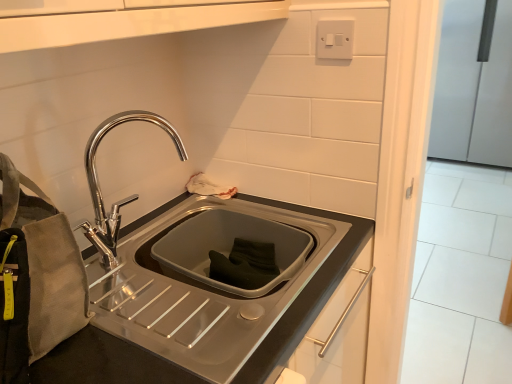
Describe the element at coordinates (335, 39) in the screenshot. I see `white plastic switch at upper right` at that location.

This screenshot has width=512, height=384. I want to click on polished metal faucet at upper left, so click(x=99, y=185).

What are the coordinates of `satin silver refrigerator at right` in the screenshot? It's located at (474, 84).

You are a GUI agent. You are given a task and a screenshot of the screen. Output one action in this format:
    pyautogui.click(x=<x>, y=<y>)
    Task: Click on the white plastic switch at upper right
    
    Given the screenshot: What is the action you would take?
    pyautogui.click(x=335, y=39)

Looking at this image, from a real-world perspective, is satin silver refrigerator at right positioned under white plastic switch at upper right based on gravity?

Yes, from a real-world perspective, satin silver refrigerator at right is below white plastic switch at upper right.

Who is shorter, satin silver refrigerator at right or white plastic switch at upper right?

white plastic switch at upper right is shorter.

Could you tell me if satin silver refrigerator at right is turned towards white plastic switch at upper right?

Yes, satin silver refrigerator at right is facing white plastic switch at upper right.

From the picture: Is canvas pouch at left positioned with its back to white plastic switch at upper right?

No, canvas pouch at left is not facing the opposite direction of white plastic switch at upper right.

From the picture: Considering the relative sizes of canvas pouch at left and white plastic switch at upper right in the image provided, is canvas pouch at left thinner than white plastic switch at upper right?

No, canvas pouch at left is not thinner than white plastic switch at upper right.

In the image, there is a canvas pouch at left. Find the location of `electric outlet above it (from the image's perspective)`. electric outlet above it (from the image's perspective) is located at coordinates (335, 39).

Image resolution: width=512 pixels, height=384 pixels. I want to click on tap above the satin silver refrigerator at right (from a real-world perspective), so click(99, 185).

Is satin silver refrigerator at right behind polished metal faucet at upper left?

Yes, satin silver refrigerator at right is further from the camera.

Does satin silver refrigerator at right appear on the right side of polished metal faucet at upper left?

Correct, you'll find satin silver refrigerator at right to the right of polished metal faucet at upper left.

From the picture: Are canvas pouch at left and satin silver refrigerator at right making contact?

There is a gap between canvas pouch at left and satin silver refrigerator at right.

Considering their positions, is canvas pouch at left located in front of or behind satin silver refrigerator at right?

canvas pouch at left is positioned closer to the viewer than satin silver refrigerator at right.

Looking at this image, from their relative heights in the image, would you say canvas pouch at left is taller or shorter than satin silver refrigerator at right?

Result: Clearly, canvas pouch at left is shorter compared to satin silver refrigerator at right.

Can you confirm if canvas pouch at left is wider than satin silver refrigerator at right?

No, canvas pouch at left is not wider than satin silver refrigerator at right.

Is white plastic switch at upper right positioned with its back to polished metal faucet at upper left?

No, polished metal faucet at upper left is not at the back of white plastic switch at upper right.

From a real-world perspective, is white plastic switch at upper right above or below polished metal faucet at upper left?

white plastic switch at upper right is above polished metal faucet at upper left.

Which object is further away from the camera taking this photo, white plastic switch at upper right or polished metal faucet at upper left?

white plastic switch at upper right is behind.

From the image's perspective, would you say white plastic switch at upper right is positioned over polished metal faucet at upper left?

Indeed, from the image's perspective, white plastic switch at upper right is shown above polished metal faucet at upper left.

Is white plastic switch at upper right oriented away from satin silver refrigerator at right?

That's right, white plastic switch at upper right is facing away from satin silver refrigerator at right.

From a real-world perspective, who is located higher, white plastic switch at upper right or satin silver refrigerator at right?

white plastic switch at upper right, from a real-world perspective.

Which is farther from the camera, [347,45] or [452,90]?

The point [452,90] is farther.

Choose the correct answer: Is white plastic switch at upper right inside satin silver refrigerator at right or outside it?

white plastic switch at upper right cannot be found inside satin silver refrigerator at right.

Which of these two, satin silver refrigerator at right or canvas pouch at left, stands shorter?

With less height is canvas pouch at left.

Considering the positions of objects satin silver refrigerator at right and canvas pouch at left in the image provided, who is behind, satin silver refrigerator at right or canvas pouch at left?

satin silver refrigerator at right is further from the camera.

Consider the image. From the image's perspective, between satin silver refrigerator at right and canvas pouch at left, which one is located above?

From the image's view, satin silver refrigerator at right is above.

Can you see satin silver refrigerator at right touching canvas pouch at left?

No, satin silver refrigerator at right is not next to canvas pouch at left.

Identify the location of electric outlet in front of the satin silver refrigerator at right. (335, 39).

The width and height of the screenshot is (512, 384). Find the location of `pouch that is under the white plastic switch at upper right (from a real-world perspective)`. pouch that is under the white plastic switch at upper right (from a real-world perspective) is located at coordinates pos(35,276).

Which object lies nearer to the anchor point white plastic switch at upper right, canvas pouch at left or polished metal faucet at upper left?

Based on the image, polished metal faucet at upper left appears to be nearer to white plastic switch at upper right.

Based on their spatial positions, is polished metal faucet at upper left or canvas pouch at left further from satin silver refrigerator at right?

The object further to satin silver refrigerator at right is canvas pouch at left.

Looking at the image, which one is located closer to canvas pouch at left, satin silver refrigerator at right or polished metal faucet at upper left?

Based on the image, polished metal faucet at upper left appears to be nearer to canvas pouch at left.

Considering their positions, is polished metal faucet at upper left positioned further to canvas pouch at left than white plastic switch at upper right?

white plastic switch at upper right.

Considering their positions, is canvas pouch at left positioned closer to satin silver refrigerator at right than white plastic switch at upper right?

white plastic switch at upper right is closer to satin silver refrigerator at right.

Looking at the image, which one is located closer to canvas pouch at left, white plastic switch at upper right or satin silver refrigerator at right?

Based on the image, white plastic switch at upper right appears to be nearer to canvas pouch at left.

Looking at the image, which one is located closer to polished metal faucet at upper left, satin silver refrigerator at right or canvas pouch at left?

Based on the image, canvas pouch at left appears to be nearer to polished metal faucet at upper left.

Which object lies nearer to the anchor point white plastic switch at upper right, polished metal faucet at upper left or satin silver refrigerator at right?

polished metal faucet at upper left.

Where is `tap between canvas pouch at left and satin silver refrigerator at right in the front-back direction`? tap between canvas pouch at left and satin silver refrigerator at right in the front-back direction is located at coordinates (99, 185).

You are a GUI agent. You are given a task and a screenshot of the screen. Output one action in this format:
    pyautogui.click(x=<x>, y=<y>)
    Task: Click on the electric outlet between canvas pouch at left and satin silver refrigerator at right along the z-axis
    The width and height of the screenshot is (512, 384).
    Given the screenshot: What is the action you would take?
    pyautogui.click(x=335, y=39)

The width and height of the screenshot is (512, 384). I want to click on electric outlet between polished metal faucet at upper left and satin silver refrigerator at right along the z-axis, so click(x=335, y=39).

Where is `tap between canvas pouch at left and white plastic switch at upper right from left to right`? Image resolution: width=512 pixels, height=384 pixels. tap between canvas pouch at left and white plastic switch at upper right from left to right is located at coordinates (99, 185).